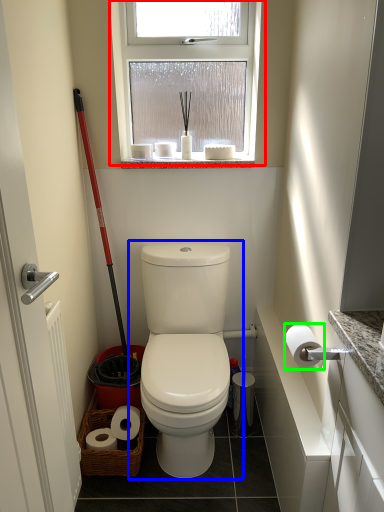
Question: Estimate the real-world distances between objects in this image. Which object is farther from window (highlighted by a red box), toilet (highlighted by a blue box) or toilet paper (highlighted by a green box)?

Choices:
 (A) toilet
 (B) toilet paper

Answer: (B)